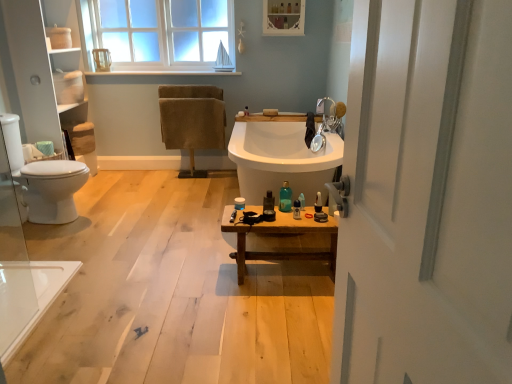
This screenshot has width=512, height=384. Identify the location of vacant area that is in front of translucent plastic tube at center, the fifth toiletry viewed from the left. (302, 215).